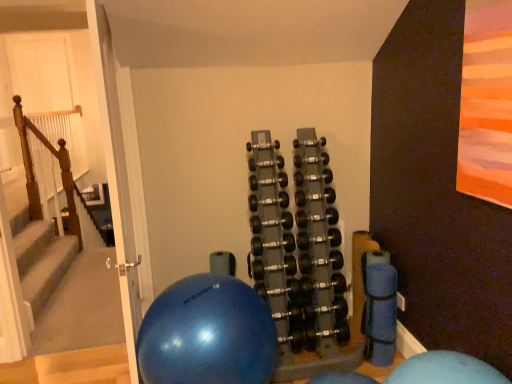
Question: Is wooden at left located outside black rubber dumbbells at center?

Choices:
 (A) no
 (B) yes

Answer: (B)

Question: Would you consider wooden at left to be distant from black rubber dumbbells at center?

Choices:
 (A) yes
 (B) no

Answer: (A)

Question: From a real-world perspective, is wooden at left positioned over black rubber dumbbells at center based on gravity?

Choices:
 (A) no
 (B) yes

Answer: (B)

Question: Considering the relative sizes of wooden at left and black rubber dumbbells at center in the image provided, is wooden at left taller than black rubber dumbbells at center?

Choices:
 (A) yes
 (B) no

Answer: (A)

Question: From a real-world perspective, is wooden at left physically below black rubber dumbbells at center?

Choices:
 (A) yes
 (B) no

Answer: (B)

Question: From their relative heights in the image, would you say wooden at left is taller or shorter than black rubber dumbbells at center?

Choices:
 (A) tall
 (B) short

Answer: (A)

Question: Looking at the image, does wooden at left seem bigger or smaller compared to black rubber dumbbells at center?

Choices:
 (A) big
 (B) small

Answer: (B)

Question: Considering their positions, is wooden at left located in front of or behind black rubber dumbbells at center?

Choices:
 (A) behind
 (B) front

Answer: (A)

Question: Is wooden at left inside or outside of black rubber dumbbells at center?

Choices:
 (A) outside
 (B) inside

Answer: (A)

Question: Is point (224, 342) closer or farther from the camera than point (61, 165)?

Choices:
 (A) closer
 (B) farther

Answer: (A)

Question: From their relative heights in the image, would you say blue rubber ball at center is taller or shorter than wooden at left?

Choices:
 (A) short
 (B) tall

Answer: (A)

Question: Based on their sizes in the image, would you say blue rubber ball at center is bigger or smaller than wooden at left?

Choices:
 (A) big
 (B) small

Answer: (A)

Question: Considering their positions, is blue rubber ball at center located in front of or behind wooden at left?

Choices:
 (A) behind
 (B) front

Answer: (B)

Question: Considering the positions of point (314, 240) and point (80, 109), is point (314, 240) closer or farther from the camera than point (80, 109)?

Choices:
 (A) farther
 (B) closer

Answer: (B)

Question: From the image's perspective, relative to wooden at left, is black rubber dumbbells at center above or below?

Choices:
 (A) above
 (B) below

Answer: (B)